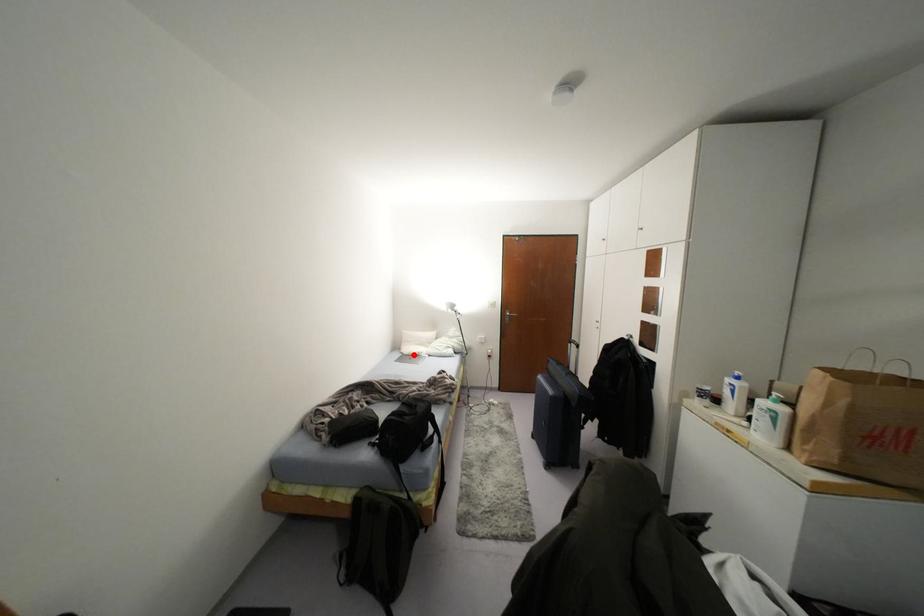
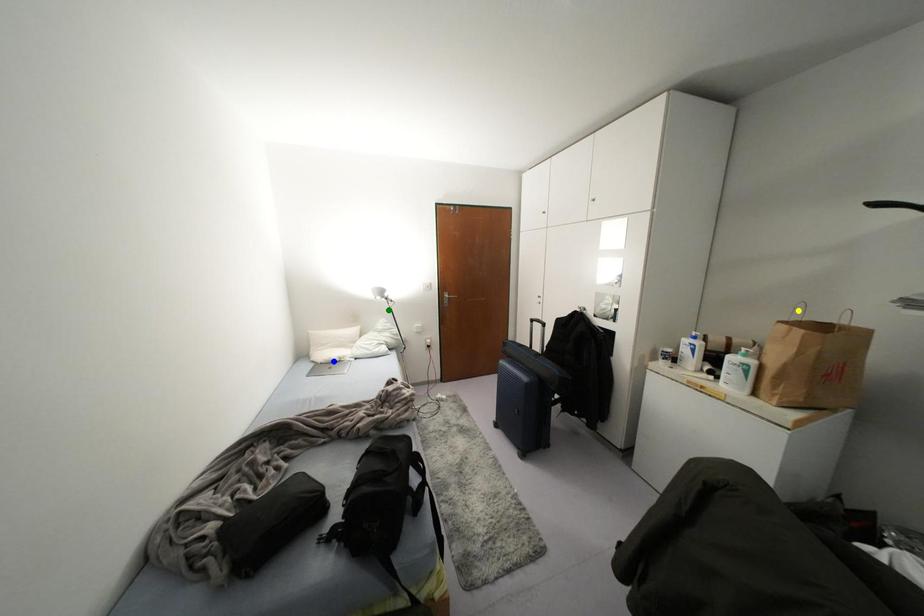
Question: I am providing you with two images of the same scene from different viewpoints. A red point is marked on the first image. You are given multiple points on the second image. Can you choose the point in image 2 that corresponds to the point in image 1?

Choices:
 (A) green point
 (B) blue point
 (C) yellow point

Answer: (B)